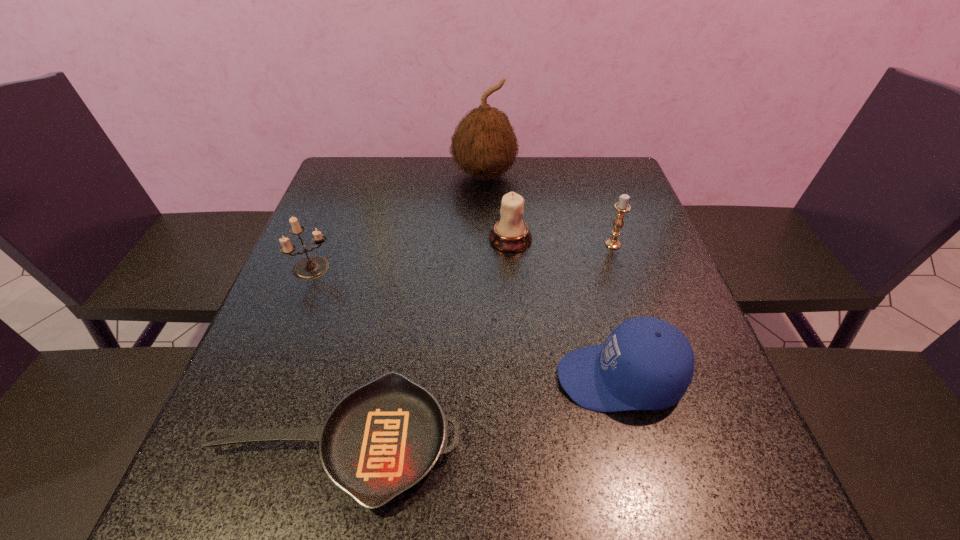
The image size is (960, 540). In order to click on empty space between the coconut and the cap in this screenshot , I will do `click(552, 276)`.

The width and height of the screenshot is (960, 540). Identify the location of vacant area that lies between the second candle holder from left to right and the frying pan. (423, 341).

The width and height of the screenshot is (960, 540). Identify the location of blank region between the nearest candle holder and the cap. (467, 323).

Image resolution: width=960 pixels, height=540 pixels. Find the location of `free point between the cap and the frying pan`. free point between the cap and the frying pan is located at coordinates (478, 410).

At what (x,y) coordinates should I click in order to perform the action: click on free point between the tallest object and the frying pan. Please return your answer as a coordinate pair (x, y). The height and width of the screenshot is (540, 960). Looking at the image, I should click on (410, 309).

In order to click on unoccupied position between the leftmost candle holder and the coconut in this screenshot , I will do `click(399, 221)`.

The height and width of the screenshot is (540, 960). Identify the location of free spot between the farthest object and the second candle holder from left to right. (497, 207).

Locate which object is the fourth closest to the rightmost candle holder. Please provide its 2D coordinates. Your answer should be formatted as a tuple, i.e. [(x, y)], where the tuple contains the x and y coordinates of a point satisfying the conditions above.

[(384, 437)]

Identify the location of object that can be found as the third closest to the second candle holder from left to right. Image resolution: width=960 pixels, height=540 pixels. [x=646, y=363].

Identify which candle holder is the second nearest to the cap. Please provide its 2D coordinates. Your answer should be formatted as a tuple, i.e. [(x, y)], where the tuple contains the x and y coordinates of a point satisfying the conditions above.

[(622, 207)]